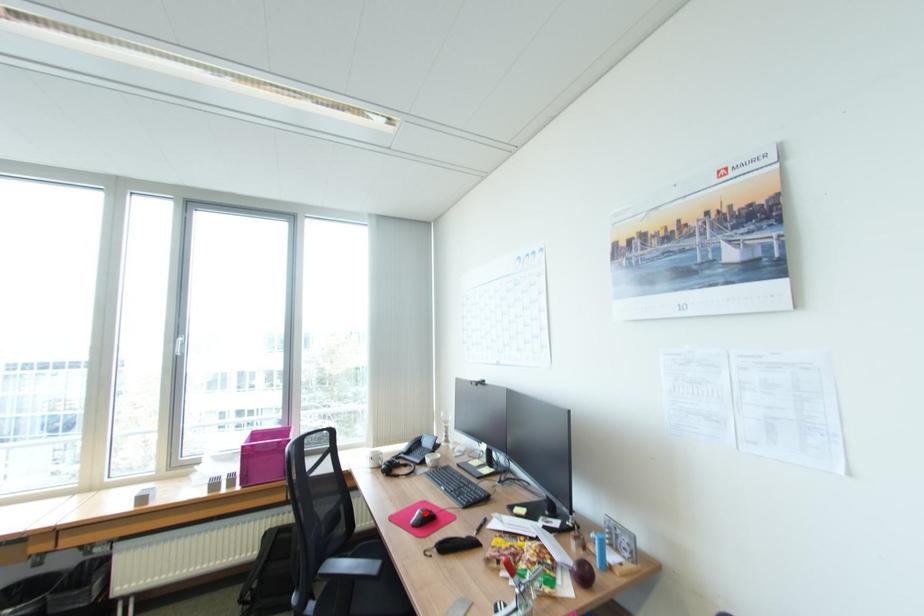
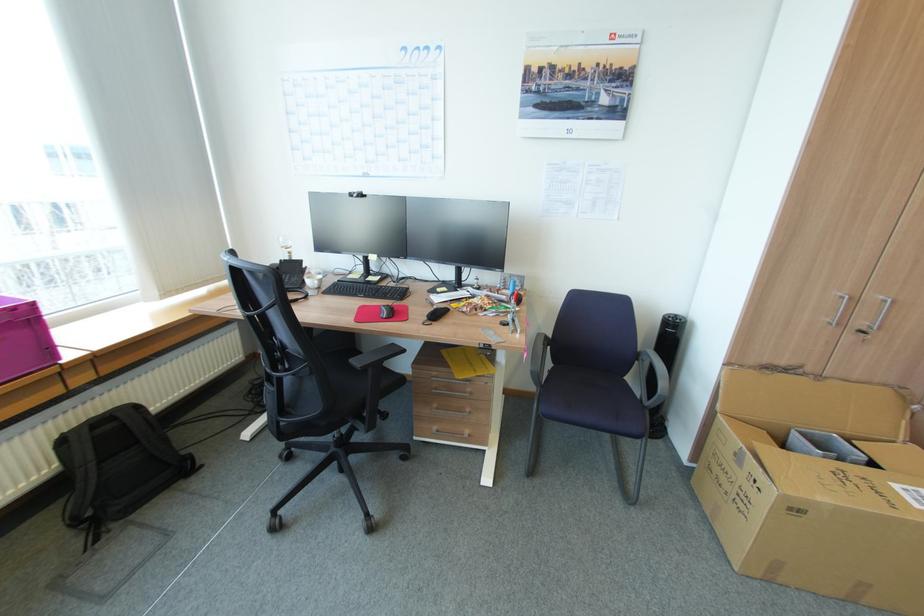
Locate, in the second image, the point that corresponds to the highlighted location in the first image.

(391, 308)